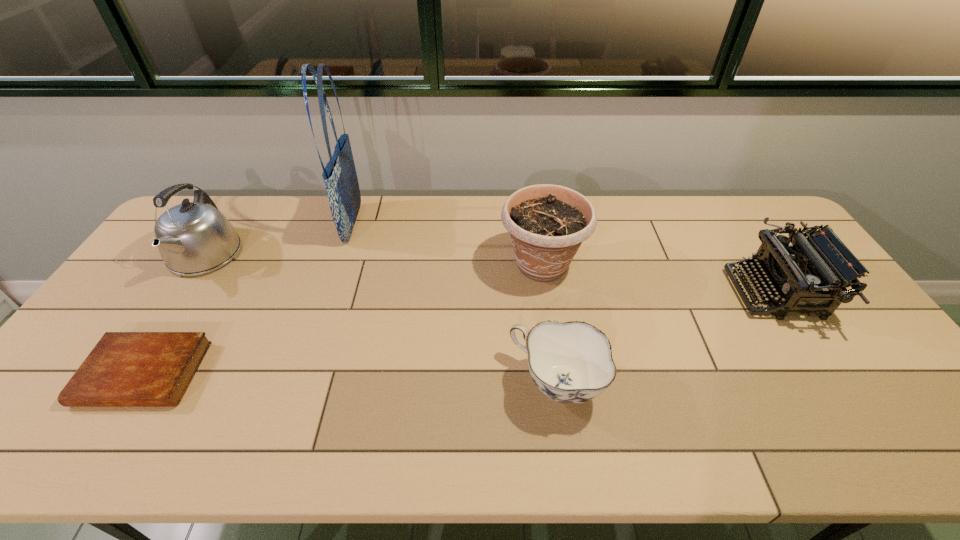
Find the location of a particular element. The height and width of the screenshot is (540, 960). vacant space situated 0.200m on the keyboard of the typewriter is located at coordinates point(666,293).

Where is `free space located on the keyboard of the typewriter`? The width and height of the screenshot is (960, 540). free space located on the keyboard of the typewriter is located at coordinates (707, 293).

I want to click on vacant space positioned 0.370m on the keyboard of the typewriter, so click(608, 293).

Image resolution: width=960 pixels, height=540 pixels. What are the coordinates of `blank space located 0.090m on the left of the chinaware` in the screenshot? It's located at (473, 384).

At what (x,y) coordinates should I click in order to perform the action: click on free spot located on the spine side of the shortest object. Please return your answer as a coordinate pair (x, y). Image resolution: width=960 pixels, height=540 pixels. Looking at the image, I should click on (109, 430).

At what (x,y) coordinates should I click in order to perform the action: click on shopping bag at the far edge. Please return your answer as a coordinate pair (x, y). Looking at the image, I should click on (342, 188).

At what (x,y) coordinates should I click in order to perform the action: click on kettle at the far edge. Please return your answer as a coordinate pair (x, y). Looking at the image, I should click on (193, 238).

The width and height of the screenshot is (960, 540). I want to click on flowerpot that is positioned at the far edge, so click(548, 223).

Identify the location of object that is at the near edge. The width and height of the screenshot is (960, 540). (x=571, y=362).

Locate an element on the screen. kettle that is at the left edge is located at coordinates (193, 238).